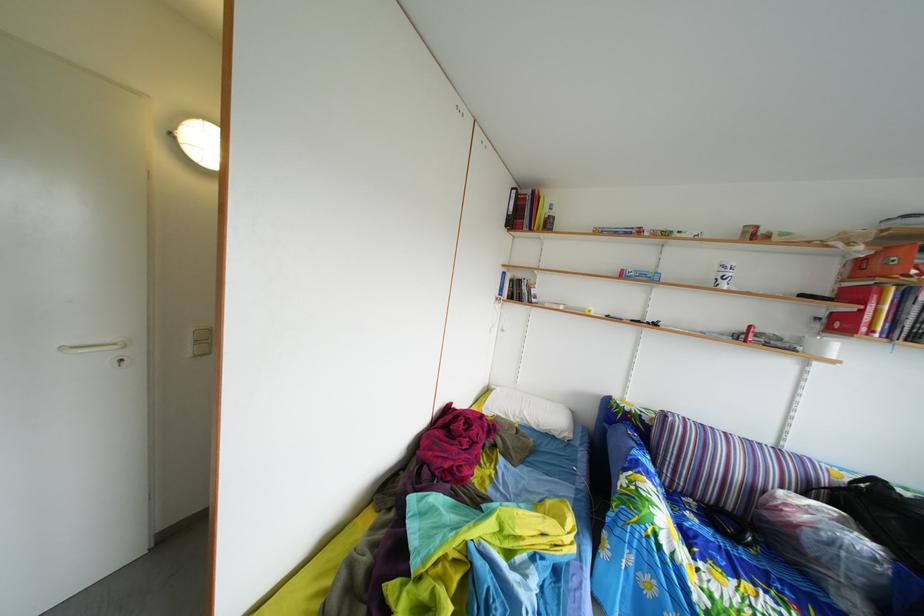
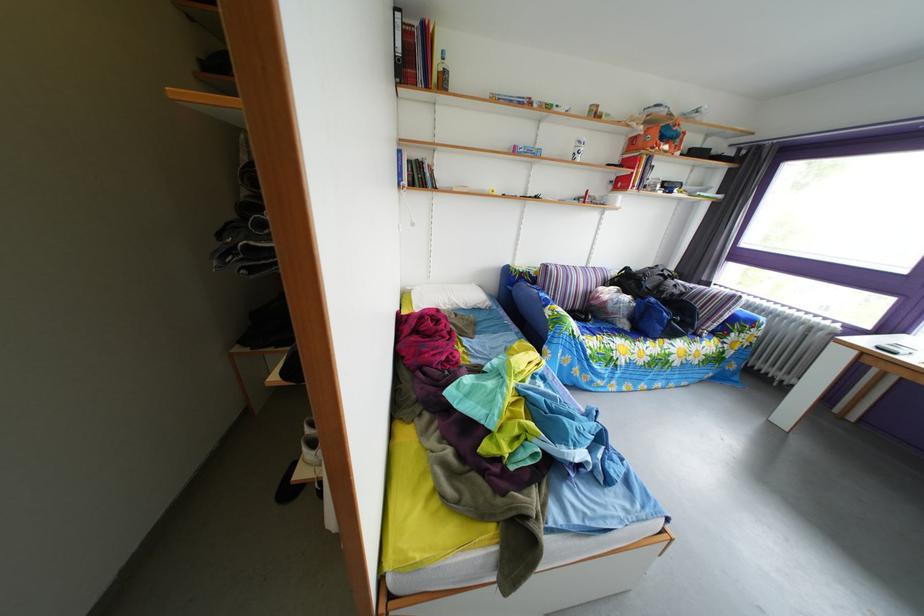
In the second image, find the point that corresponds to point (630, 430) in the first image.

(529, 289)